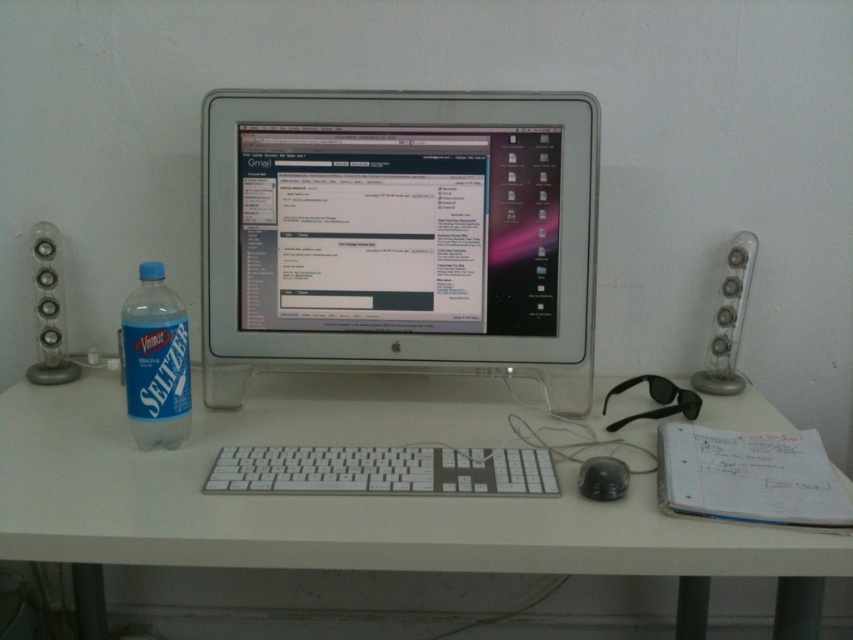
Does white plastic keyboard at center have a lesser height compared to blue plastic bottle at left?

Indeed, white plastic keyboard at center has a lesser height compared to blue plastic bottle at left.

Can you confirm if white plastic keyboard at center is positioned above blue plastic bottle at left?

No, white plastic keyboard at center is not above blue plastic bottle at left.

Which is in front, point (222, 474) or point (158, 280)?

Point (222, 474)

In order to click on white plastic keyboard at center in this screenshot , I will do `click(381, 470)`.

Which is in front, point (286, 256) or point (85, 611)?

Positioned in front is point (286, 256).

Does sleek silver monitor at center have a larger size compared to white plastic computer desk at center?

Actually, sleek silver monitor at center might be smaller than white plastic computer desk at center.

Does point (579, 324) come closer to viewer compared to point (212, 412)?

Yes, point (579, 324) is in front of point (212, 412).

Find the location of a particular element. sleek silver monitor at center is located at coordinates [399, 234].

Who is higher up, white plastic computer desk at center or black matte mouse at lower center?

black matte mouse at lower center is higher up.

This screenshot has height=640, width=853. I want to click on white plastic computer desk at center, so click(x=350, y=496).

This screenshot has width=853, height=640. What do you see at coordinates (350, 496) in the screenshot?
I see `white plastic computer desk at center` at bounding box center [350, 496].

At what (x,y) coordinates should I click in order to perform the action: click on white plastic computer desk at center. Please return your answer as a coordinate pair (x, y). This screenshot has width=853, height=640. Looking at the image, I should click on click(x=350, y=496).